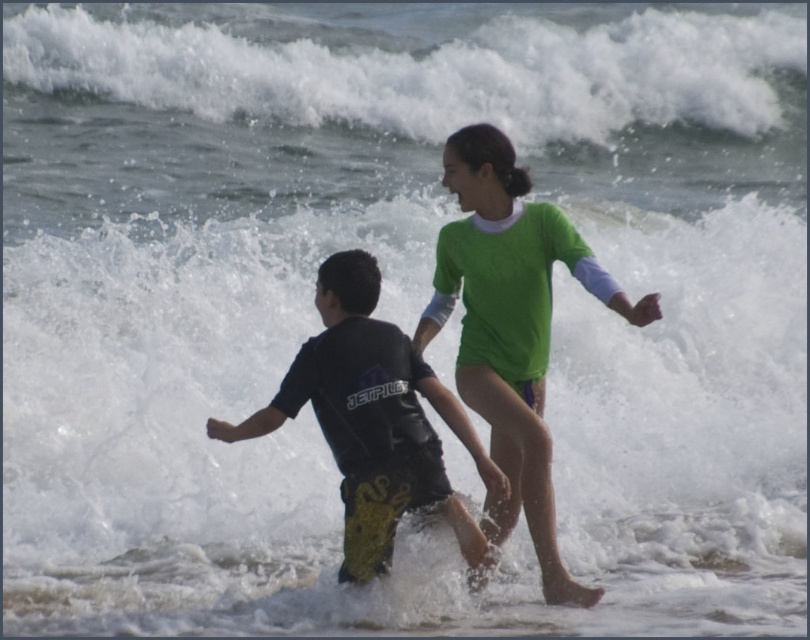
Question: Can you confirm if green fabric swimsuit at center is smaller than black matte wetsuit at center?

Choices:
 (A) yes
 (B) no

Answer: (B)

Question: Which point is closer to the camera taking this photo?

Choices:
 (A) (475, 225)
 (B) (403, 452)
 (C) (525, 67)

Answer: (B)

Question: Does green fabric swimsuit at center come behind black matte wetsuit at center?

Choices:
 (A) no
 (B) yes

Answer: (B)

Question: Which point is closer to the camera taking this photo?

Choices:
 (A) (388, 534)
 (B) (474, 346)
 (C) (770, 92)

Answer: (A)

Question: Which point is farther from the camera taking this photo?

Choices:
 (A) (472, 177)
 (B) (168, 35)
 (C) (374, 480)

Answer: (B)

Question: Can you confirm if white frothy wave at upper center is smaller than black matte wetsuit at center?

Choices:
 (A) no
 (B) yes

Answer: (A)